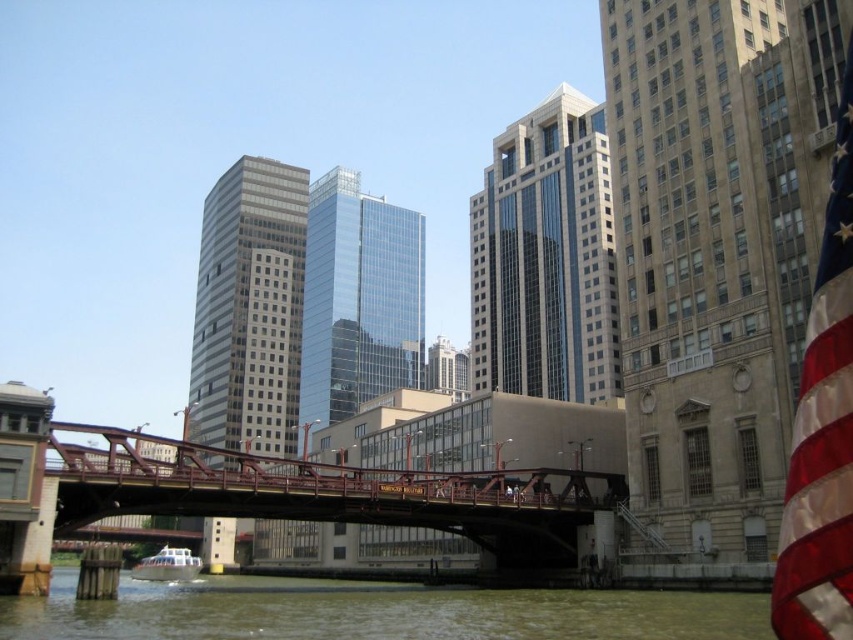
You are standing on the red pedestrian bridge and looking down at the greenish water at lower center and the white matte boat at lower center. Which object is positioned higher from your viewpoint?

The greenish water at lower center is located above the white matte boat at lower center, so it is positioned higher from your viewpoint.

You are a tourist standing on the red pedestrian bridge and want to take a photo of both the red fabric flag at right and the white matte boat at lower center. Which object will appear larger in your photo?

The red fabric flag at right will appear larger in the photo because it is taller than the white matte boat at lower center.